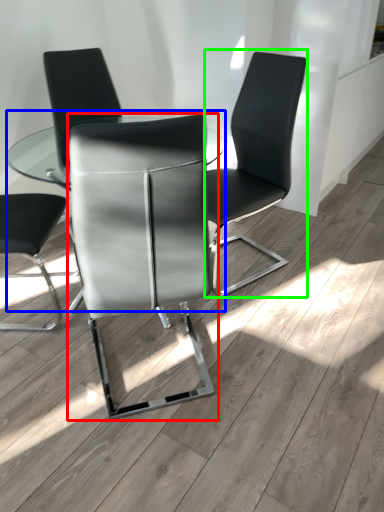
Question: Which is farther away from chair (highlighted by a red box)? table (highlighted by a blue box) or chair (highlighted by a green box)?

Choices:
 (A) table
 (B) chair

Answer: (A)